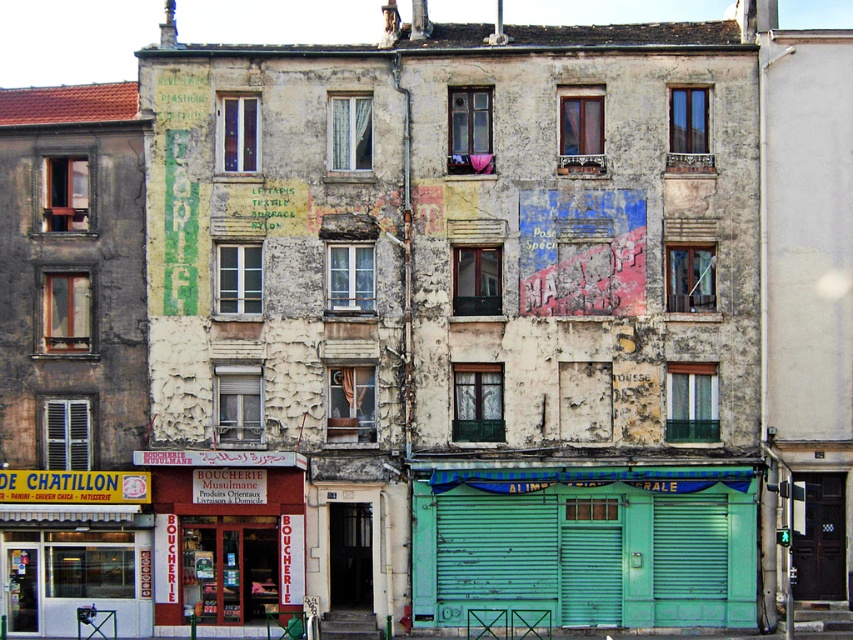
Can you confirm if green corrugated metal at center is taller than green metallic shutter at lower center?

Correct, green corrugated metal at center is much taller as green metallic shutter at lower center.

This screenshot has width=853, height=640. What do you see at coordinates (496, 547) in the screenshot?
I see `green corrugated metal at center` at bounding box center [496, 547].

Find the location of a particular element. green corrugated metal at center is located at coordinates (496, 547).

How much distance is there between red brick boucherie at lower left and wooden shutter at left?

They are 2.32 meters apart.

Between point (292, 456) and point (67, 451), which one is positioned in front?

Positioned in front is point (292, 456).

Does point (218, 605) come behind point (86, 461)?

No, it is in front of (86, 461).

Locate an element on the screen. red brick boucherie at lower left is located at coordinates (225, 532).

Who is more distant from viewer, (x=665, y=528) or (x=190, y=600)?

Point (x=190, y=600)

Between teal metal/green at lower center and red brick boucherie at lower left, which one is positioned higher?

teal metal/green at lower center is above.

Where is `teal metal/green at lower center`? This screenshot has width=853, height=640. teal metal/green at lower center is located at coordinates (585, 545).